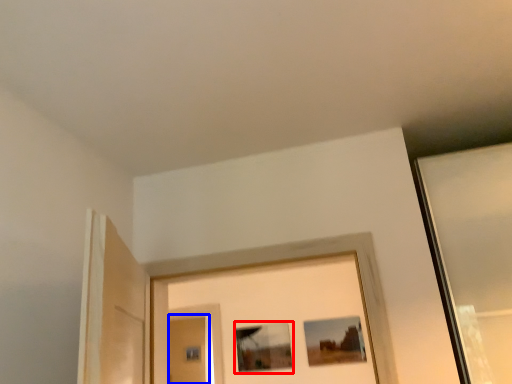
Question: Which object is closer to the camera taking this photo, picture frame (highlighted by a red box) or screen door (highlighted by a blue box)?

Choices:
 (A) picture frame
 (B) screen door

Answer: (A)